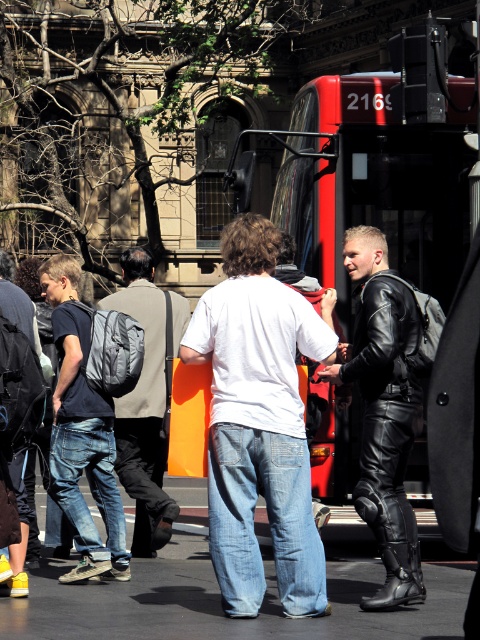
You are a photographer trying to capture a photo of the black leather jacket at center and the matte gray backpack at center. Since you want to include both in the frame, which object should you position closer to the left side of your camera viewfinder to ensure both are visible?

To include both the black leather jacket at center and the matte gray backpack at center in the frame, position the matte gray backpack at center closer to the left side of your camera viewfinder. This way, the black leather jacket at center, which is on the right side of the matte gray backpack at center, will naturally align to the right, ensuring both fit within the viewfinder.

You are a photographer standing at the camera position. You want to capture a closeup shot of the black leather jacket at center without moving the camera. Is it possible to do so with a standard lens that has a maximum focal length of 50mm?

The black leather jacket at center is 26.82 feet away from the camera. With a standard lens of 50mm, which typically has a focal length range up to 50mm, capturing a closeup shot from this distance may not be feasible as the subject would appear small in the frame. A longer focal length would be required to zoom in effectively.

You are a photographer trying to capture a clear photo of the matte gray backpack at center. However, the black leather jacket at center is blocking your view. Can you move around to the side to get an unobstructed shot?

The black leather jacket at center is in front of the matte gray backpack at center, so moving to the side might allow you to see around the jacket and capture the backpack without obstruction.